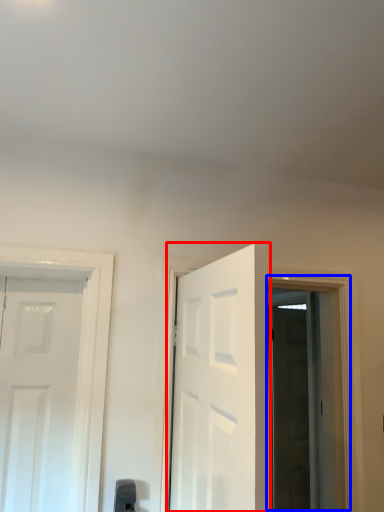
Question: Which point is further to the camera, door (highlighted by a red box) or window (highlighted by a blue box)?

Choices:
 (A) door
 (B) window

Answer: (B)